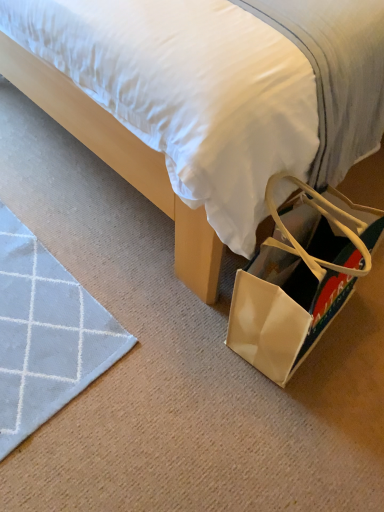
Describe the element at coordinates (120, 161) in the screenshot. I see `white fabric bed at center` at that location.

At what (x,y) coordinates should I click in order to perform the action: click on white fabric bed at center. Please return your answer as a coordinate pair (x, y). Looking at the image, I should click on (120, 161).

At what (x,y) coordinates should I click in order to perform the action: click on matte beige shoulder bag at lower right. Please return your answer as a coordinate pair (x, y). This screenshot has width=384, height=512. Looking at the image, I should click on (300, 277).

What do you see at coordinates (300, 277) in the screenshot? This screenshot has width=384, height=512. I see `matte beige shoulder bag at lower right` at bounding box center [300, 277].

The width and height of the screenshot is (384, 512). What are the coordinates of `white fabric bed at center` in the screenshot? It's located at (120, 161).

Visually, is white fabric bed at center positioned to the left or to the right of matte beige shoulder bag at lower right?

In the image, white fabric bed at center appears on the left side of matte beige shoulder bag at lower right.

Is white fabric bed at center in front of or behind matte beige shoulder bag at lower right in the image?

white fabric bed at center is in front of matte beige shoulder bag at lower right.

Considering the positions of points (168, 180) and (283, 177), is point (168, 180) farther from camera compared to point (283, 177)?

Yes, point (168, 180) is farther from viewer.

From the image's perspective, would you say white fabric bed at center is shown under matte beige shoulder bag at lower right?

Actually, white fabric bed at center appears above matte beige shoulder bag at lower right in the image.

From a real-world perspective, which object rests below the other?

matte beige shoulder bag at lower right.

Based on the photo, considering the sizes of white fabric bed at center and matte beige shoulder bag at lower right in the image, is white fabric bed at center wider or thinner than matte beige shoulder bag at lower right?

Considering their sizes, white fabric bed at center looks broader than matte beige shoulder bag at lower right.

Between white fabric bed at center and matte beige shoulder bag at lower right, which one has less height?

Standing shorter between the two is matte beige shoulder bag at lower right.

Considering the relative sizes of white fabric bed at center and matte beige shoulder bag at lower right in the image provided, is white fabric bed at center bigger than matte beige shoulder bag at lower right?

Correct, white fabric bed at center is larger in size than matte beige shoulder bag at lower right.

Do you think white fabric bed at center is within matte beige shoulder bag at lower right, or outside of it?

white fabric bed at center exists outside the volume of matte beige shoulder bag at lower right.

Based on the photo, is white fabric bed at center touching matte beige shoulder bag at lower right?

white fabric bed at center is not next to matte beige shoulder bag at lower right, and they're not touching.

Does white fabric bed at center turn towards matte beige shoulder bag at lower right?

No, white fabric bed at center is not turned towards matte beige shoulder bag at lower right.

How many degrees apart are the facing directions of white fabric bed at center and matte beige shoulder bag at lower right?

They differ by 171 degrees in their facing directions.

Measure the distance from white fabric bed at center to matte beige shoulder bag at lower right.

The distance of white fabric bed at center from matte beige shoulder bag at lower right is 10.48 inches.

Find the location of a particular element. bed in front of the matte beige shoulder bag at lower right is located at coordinates (120, 161).

Considering the relative positions of matte beige shoulder bag at lower right and white fabric bed at center in the image provided, is matte beige shoulder bag at lower right to the right of white fabric bed at center from the viewer's perspective?

Yes, matte beige shoulder bag at lower right is to the right of white fabric bed at center.

Which object is closer to the camera, matte beige shoulder bag at lower right or white fabric bed at center?

white fabric bed at center.

Considering the positions of point (283, 335) and point (150, 157), is point (283, 335) closer or farther from the camera than point (150, 157)?

Point (283, 335) is positioned closer to the camera compared to point (150, 157).

From the image's perspective, is matte beige shoulder bag at lower right above white fabric bed at center?

Incorrect, from the image's perspective, matte beige shoulder bag at lower right is lower than white fabric bed at center.

From a real-world perspective, who is located higher, matte beige shoulder bag at lower right or white fabric bed at center?

From a 3D spatial view, white fabric bed at center is above.

Can you confirm if matte beige shoulder bag at lower right is thinner than white fabric bed at center?

Indeed, matte beige shoulder bag at lower right has a lesser width compared to white fabric bed at center.

In terms of height, does matte beige shoulder bag at lower right look taller or shorter compared to white fabric bed at center?

In the image, matte beige shoulder bag at lower right appears to be shorter than white fabric bed at center.

Does matte beige shoulder bag at lower right have a smaller size compared to white fabric bed at center?

Indeed, matte beige shoulder bag at lower right has a smaller size compared to white fabric bed at center.

Choose the correct answer: Is matte beige shoulder bag at lower right inside white fabric bed at center or outside it?

matte beige shoulder bag at lower right is spatially situated outside white fabric bed at center.

Is matte beige shoulder bag at lower right next to white fabric bed at center?

There is a gap between matte beige shoulder bag at lower right and white fabric bed at center.

Is matte beige shoulder bag at lower right turned away from white fabric bed at center?

No.

What's the angular difference between matte beige shoulder bag at lower right and white fabric bed at center's facing directions?

171 degrees.

Image resolution: width=384 pixels, height=512 pixels. I want to click on bed on the left of matte beige shoulder bag at lower right, so click(x=120, y=161).

Identify the location of shoulder bag on the right of white fabric bed at center. (300, 277).

Find the location of a particular element. The image size is (384, 512). bed on the left of matte beige shoulder bag at lower right is located at coordinates coord(120,161).